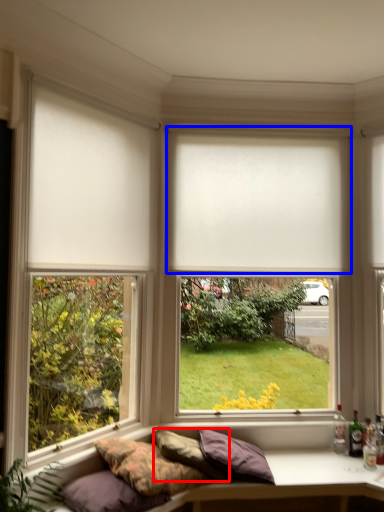
Question: Which point is closer to the camera, pillow (highlighted by a red box) or window blind (highlighted by a blue box)?

Choices:
 (A) pillow
 (B) window blind

Answer: (A)